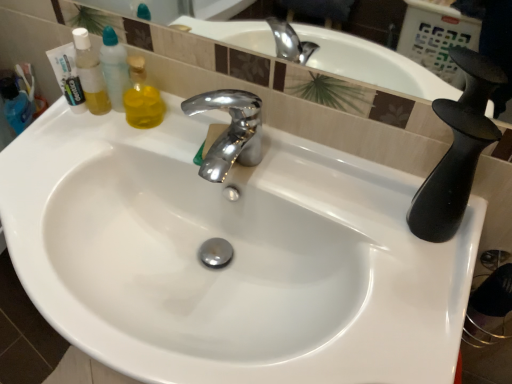
Where is `vacant area situated to the left side of polished chrome faucet at center`? Image resolution: width=512 pixels, height=384 pixels. vacant area situated to the left side of polished chrome faucet at center is located at coordinates click(141, 143).